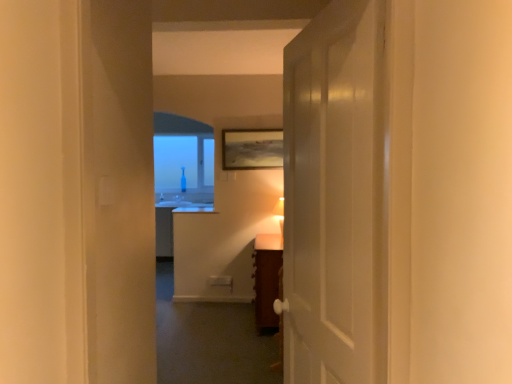
Describe the element at coordinates (175, 162) in the screenshot. This screenshot has height=384, width=512. I see `transparent glass bottle at center` at that location.

What do you see at coordinates (280, 214) in the screenshot? The height and width of the screenshot is (384, 512). I see `matte white table lamp at center` at bounding box center [280, 214].

In order to face matte white table lamp at center, should I rotate leftwards or rightwards?

To align with it, rotate right about 3.113°.

Locate an element on the screen. Image resolution: width=512 pixels, height=384 pixels. matte wooden picture frame at upper center is located at coordinates (252, 149).

This screenshot has width=512, height=384. What are the coordinates of `transparent glass bottle at center` in the screenshot? It's located at (175, 162).

Is matte white table lamp at center aimed at matte wooden picture frame at upper center?

No, matte white table lamp at center is not oriented towards matte wooden picture frame at upper center.

From a real-world perspective, relative to matte wooden picture frame at upper center, is matte white table lamp at center vertically above or below?

Clearly, from a real-world perspective, matte white table lamp at center is below matte wooden picture frame at upper center.

Is point (280, 223) closer or farther from the camera than point (269, 144)?

Point (280, 223) is closer to the camera than point (269, 144).

From a real-world perspective, is white glossy door at center physically below brown wooden vanity at center?

No, from a real-world perspective, white glossy door at center is not beneath brown wooden vanity at center.

Could you tell me if white glossy door at center is turned towards brown wooden vanity at center?

No.

Consider the image. Can you confirm if white glossy door at center is thinner than brown wooden vanity at center?

Indeed, white glossy door at center has a lesser width compared to brown wooden vanity at center.

This screenshot has width=512, height=384. I want to click on door located above the brown wooden vanity at center (from the image's perspective), so click(336, 196).

Between transparent glass bottle at center and brown wooden vanity at center, which one has larger size?

With larger size is transparent glass bottle at center.

Locate an element on the screen. The image size is (512, 384). window screen that appears above the brown wooden vanity at center (from a real-world perspective) is located at coordinates (175, 162).

Can you confirm if transparent glass bottle at center is thinner than brown wooden vanity at center?

Yes, transparent glass bottle at center is thinner than brown wooden vanity at center.

Is the surface of transparent glass bottle at center in direct contact with brown wooden vanity at center?

transparent glass bottle at center and brown wooden vanity at center are not in contact.

Is white glossy door at center not close to transparent glass bottle at center?

Yes, white glossy door at center is far from transparent glass bottle at center.

Is white glossy door at center behind transparent glass bottle at center?

No, it is in front of transparent glass bottle at center.

Is transparent glass bottle at center completely or partially inside white glossy door at center?

Definitely not — transparent glass bottle at center is not inside white glossy door at center.

From a real-world perspective, who is located higher, white glossy door at center or transparent glass bottle at center?

From a 3D spatial view, transparent glass bottle at center is above.

Can matte white table lamp at center be found inside white glossy door at center?

No, matte white table lamp at center is not inside white glossy door at center.

Is white glossy door at center to the right of matte white table lamp at center from the viewer's perspective?

Correct, you'll find white glossy door at center to the right of matte white table lamp at center.

In the image, there is a white glossy door at center. In order to click on table lamp below it (from the image's perspective) in this screenshot , I will do `click(280, 214)`.

From a real-world perspective, between matte white table lamp at center and white glossy door at center, who is vertically higher?

white glossy door at center.

Could you tell me if matte white table lamp at center is turned towards white glossy door at center?

No, matte white table lamp at center is not oriented towards white glossy door at center.

Measure the distance from matte white table lamp at center to white glossy door at center.

The distance of matte white table lamp at center from white glossy door at center is 3.04 meters.

Where is `table lamp below the white glossy door at center (from a real-world perspective)`? Image resolution: width=512 pixels, height=384 pixels. table lamp below the white glossy door at center (from a real-world perspective) is located at coordinates click(x=280, y=214).

Can you tell me how much matte wooden picture frame at upper center and matte white table lamp at center differ in facing direction?

There is a 90-degree angle between the facing directions of matte wooden picture frame at upper center and matte white table lamp at center.

Considering the relative positions of matte wooden picture frame at upper center and matte white table lamp at center in the image provided, is matte wooden picture frame at upper center to the right of matte white table lamp at center from the viewer's perspective?

No, matte wooden picture frame at upper center is not to the right of matte white table lamp at center.

From a real-world perspective, who is located higher, matte wooden picture frame at upper center or matte white table lamp at center?

matte wooden picture frame at upper center is physically above.

From the image's perspective, is matte wooden picture frame at upper center below matte white table lamp at center?

Incorrect, from the image's perspective, matte wooden picture frame at upper center is higher than matte white table lamp at center.

Identify the location of table lamp below the matte wooden picture frame at upper center (from the image's perspective). (280, 214).

I want to click on door lying on the right of brown wooden vanity at center, so click(x=336, y=196).

Consider the image. Which object lies nearer to the anchor point matte white table lamp at center, brown wooden vanity at center or matte wooden picture frame at upper center?

Among the two, matte wooden picture frame at upper center is located nearer to matte white table lamp at center.

Considering their positions, is white glossy door at center positioned further to brown wooden vanity at center than transparent glass bottle at center?

Based on the image, transparent glass bottle at center appears to be further to brown wooden vanity at center.

From the image, which object appears to be farther from brown wooden vanity at center, transparent glass bottle at center or matte white table lamp at center?

The object further to brown wooden vanity at center is transparent glass bottle at center.

Looking at the image, which one is located further to matte white table lamp at center, transparent glass bottle at center or matte wooden picture frame at upper center?

Among the two, transparent glass bottle at center is located further to matte white table lamp at center.

When comparing their distances from matte white table lamp at center, does white glossy door at center or matte wooden picture frame at upper center seem further?

Among the two, white glossy door at center is located further to matte white table lamp at center.

Looking at the image, which one is located closer to matte wooden picture frame at upper center, white glossy door at center or matte white table lamp at center?

matte white table lamp at center lies closer to matte wooden picture frame at upper center than the other object.

Estimate the real-world distances between objects in this image. Which object is closer to white glossy door at center, brown wooden vanity at center or matte white table lamp at center?

brown wooden vanity at center is positioned closer to the anchor white glossy door at center.

When comparing their distances from matte wooden picture frame at upper center, does brown wooden vanity at center or transparent glass bottle at center seem closer?

brown wooden vanity at center lies closer to matte wooden picture frame at upper center than the other object.

I want to click on vanity between white glossy door at center and matte wooden picture frame at upper center from front to back, so click(x=266, y=280).

The width and height of the screenshot is (512, 384). Identify the location of table lamp between matte wooden picture frame at upper center and brown wooden vanity at center in the vertical direction. (280, 214).

Locate an element on the screen. table lamp between white glossy door at center and matte wooden picture frame at upper center in the front-back direction is located at coordinates (280, 214).

The image size is (512, 384). In order to click on table lamp between white glossy door at center and transparent glass bottle at center from front to back in this screenshot , I will do `click(280, 214)`.